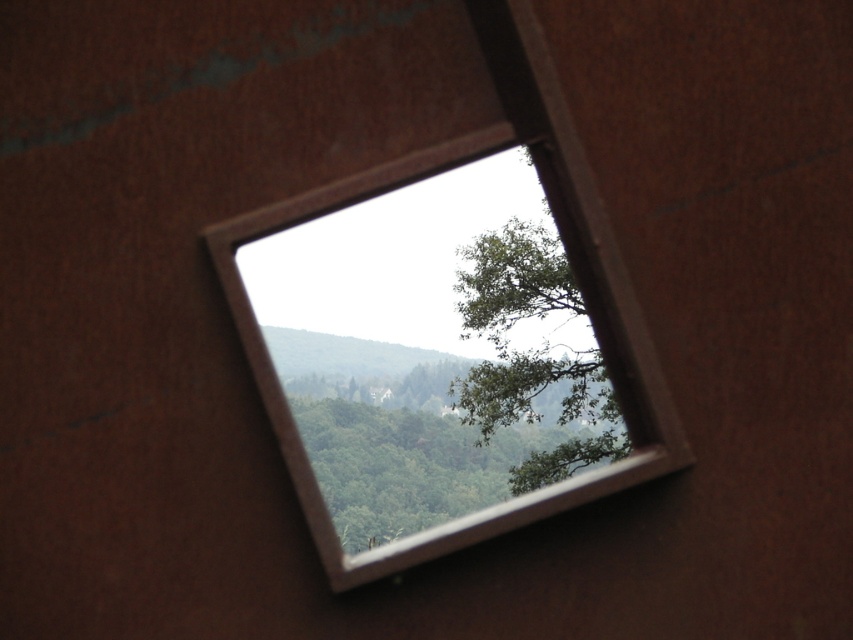
Question: Can you confirm if metallic silver window frame at center is positioned above green leafy tree at upper center?

Choices:
 (A) no
 (B) yes

Answer: (B)

Question: Which point is closer to the camera taking this photo?

Choices:
 (A) (607, 477)
 (B) (497, 298)

Answer: (A)

Question: Which object appears farthest from the camera in this image?

Choices:
 (A) metallic silver window frame at center
 (B) green leafy tree at upper center

Answer: (B)

Question: Can you confirm if metallic silver window frame at center is positioned below green leafy tree at upper center?

Choices:
 (A) no
 (B) yes

Answer: (A)

Question: Is metallic silver window frame at center to the left of green leafy tree at upper center from the viewer's perspective?

Choices:
 (A) no
 (B) yes

Answer: (B)